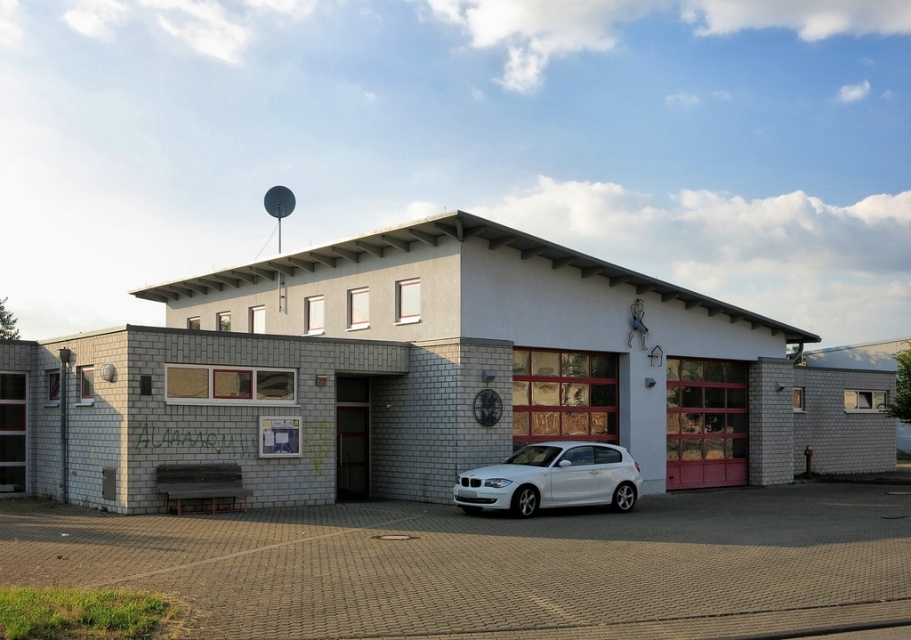
Question: Is white brick fire station at center to the right of white glossy hatchback at center from the viewer's perspective?

Choices:
 (A) yes
 (B) no

Answer: (A)

Question: Which of the following is the closest to the observer?

Choices:
 (A) (551, 481)
 (B) (211, 362)

Answer: (A)

Question: Among these objects, which one is nearest to the camera?

Choices:
 (A) white glossy hatchback at center
 (B) white brick fire station at center

Answer: (B)

Question: Considering the relative positions of white brick fire station at center and white glossy hatchback at center in the image provided, where is white brick fire station at center located with respect to white glossy hatchback at center?

Choices:
 (A) above
 (B) below

Answer: (A)

Question: Considering the relative positions of white brick fire station at center and white glossy hatchback at center in the image provided, where is white brick fire station at center located with respect to white glossy hatchback at center?

Choices:
 (A) below
 (B) above

Answer: (B)

Question: Which point is closer to the camera?

Choices:
 (A) (336, 339)
 (B) (456, 496)

Answer: (B)